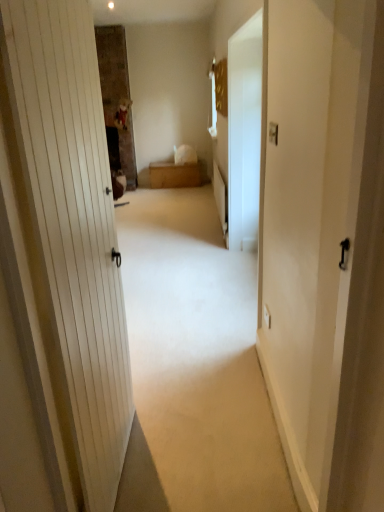
You are a GUI agent. You are given a task and a screenshot of the screen. Output one action in this format:
    pyautogui.click(x=<x>, y=<y>)
    Task: Click on the vacant area that is in front of white glossy screen door at center
    The image size is (384, 512).
    Given the screenshot: What is the action you would take?
    pyautogui.click(x=196, y=370)